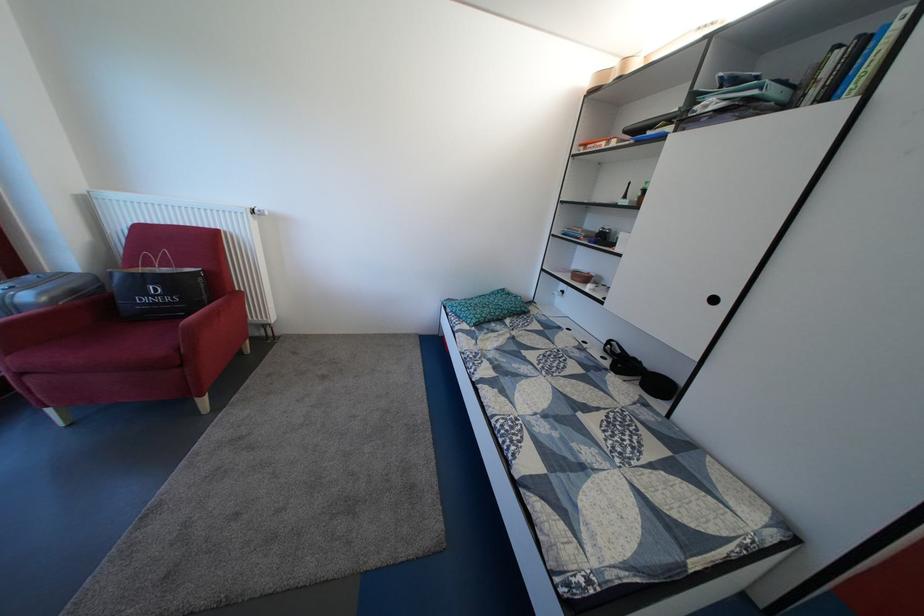
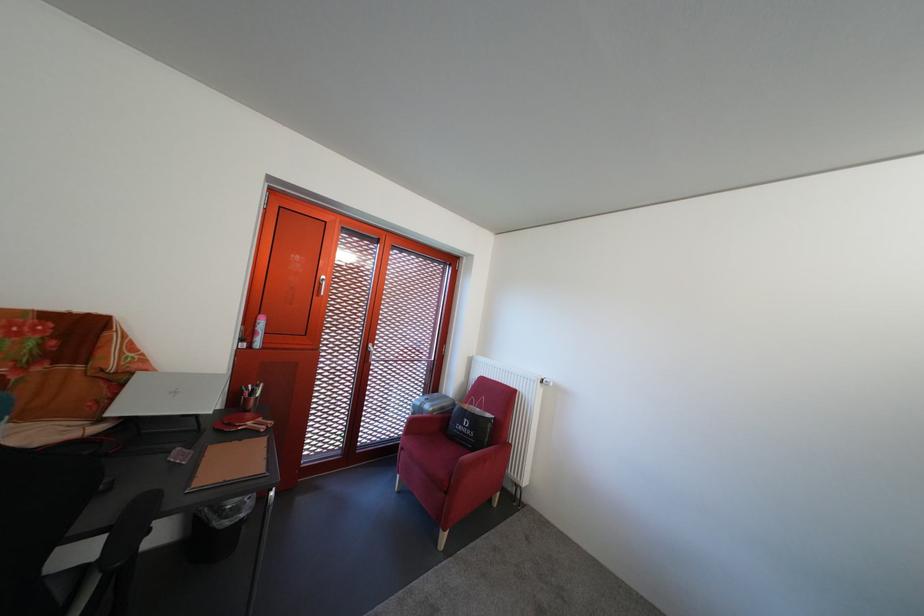
In the second image, find the point that corresponds to pixel 84 298 in the first image.

(454, 415)